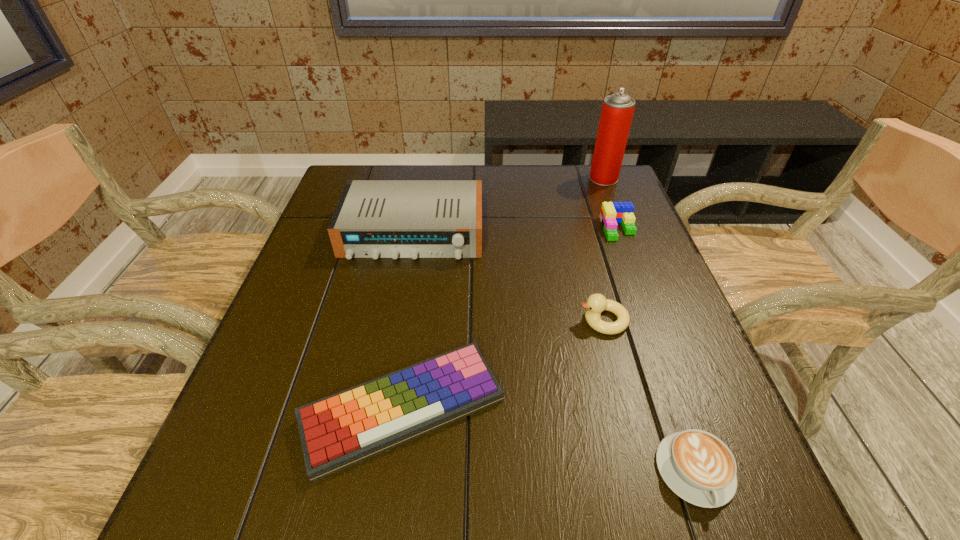
I want to click on aerosol can, so click(x=617, y=111).

The width and height of the screenshot is (960, 540). In order to click on the tallest object in this screenshot , I will do `click(617, 111)`.

Image resolution: width=960 pixels, height=540 pixels. I want to click on the second tallest object, so (375, 219).

This screenshot has width=960, height=540. In order to click on the fourth shortest object in this screenshot , I will do `click(596, 303)`.

The height and width of the screenshot is (540, 960). What are the coordinates of `duckling` in the screenshot? It's located at (596, 303).

You are a GUI agent. You are given a task and a screenshot of the screen. Output one action in this format:
    pyautogui.click(x=<x>, y=<y>)
    Task: Click on the Lego
    
    Given the screenshot: What is the action you would take?
    pyautogui.click(x=611, y=213)

Identify the location of cappuccino. (697, 466).

This screenshot has height=540, width=960. Identify the location of computer keyboard. (345, 428).

This screenshot has width=960, height=540. I want to click on vacant area located 0.290m on the front of the aerosol can, so click(x=631, y=247).

The height and width of the screenshot is (540, 960). Find the location of `vacant space located on the control panel of the radio receiver`. vacant space located on the control panel of the radio receiver is located at coordinates (396, 322).